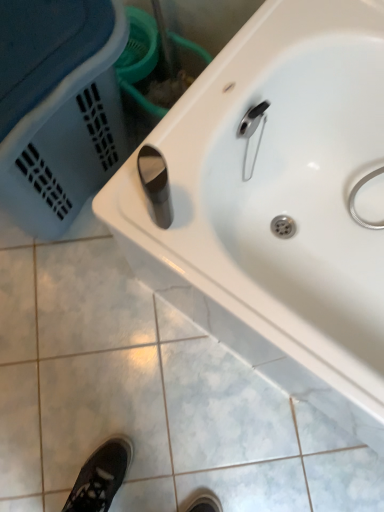
At what (x,y) coordinates should I click in order to perform the action: click on white glossy sink at upper center. Please return your answer as a coordinate pair (x, y). The height and width of the screenshot is (512, 384). Looking at the image, I should click on (276, 205).

Describe the element at coordinates (276, 205) in the screenshot. I see `white glossy sink at upper center` at that location.

Locate an element on the screen. white glossy sink at upper center is located at coordinates (276, 205).